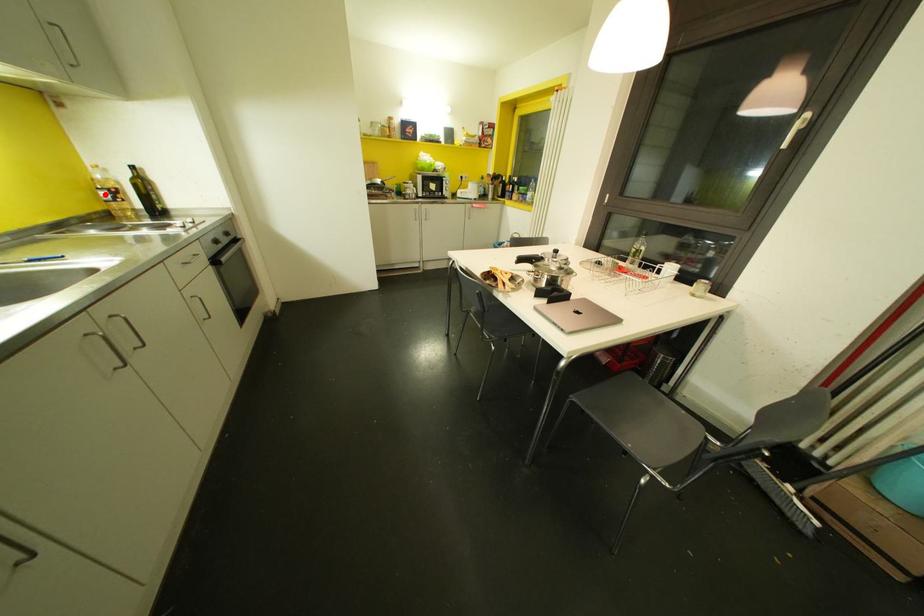
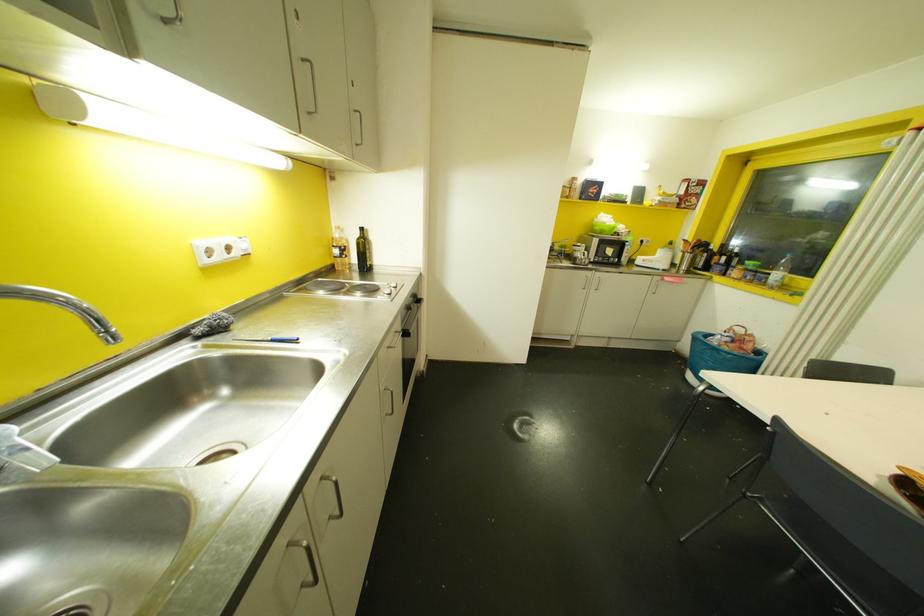
The point at the highlighted location is marked in the first image. Where is the corresponding point in the second image?

(335, 251)